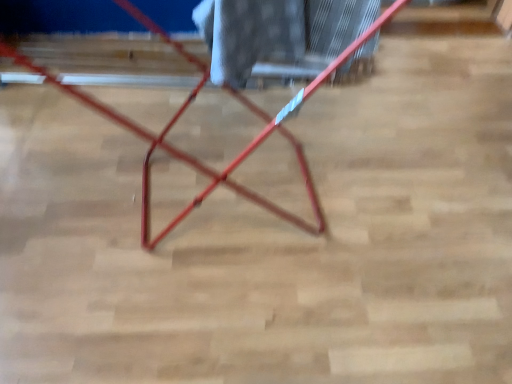
Locate an element on the screen. white textured fabric at center is located at coordinates (278, 35).

The image size is (512, 384). What do you see at coordinates (278, 35) in the screenshot? I see `white textured fabric at center` at bounding box center [278, 35].

Measure the distance between point (318, 26) and camera.

Point (318, 26) is 1.18 meters from camera.

Image resolution: width=512 pixels, height=384 pixels. What do you see at coordinates (183, 151) in the screenshot?
I see `metallic red ladder at center` at bounding box center [183, 151].

Image resolution: width=512 pixels, height=384 pixels. I want to click on metallic red ladder at center, so click(x=183, y=151).

Measure the distance between point (147, 184) and camera.

Point (147, 184) is 1.51 meters from camera.

What is the approximate height of metallic red ladder at center?

metallic red ladder at center is 33.49 inches in height.

In order to click on white textured fabric at center in this screenshot , I will do `click(278, 35)`.

Based on their positions, is white textured fabric at center located to the left or right of metallic red ladder at center?

white textured fabric at center is positioned on metallic red ladder at center's right side.

Is white textured fabric at center in front of or behind metallic red ladder at center in the image?

white textured fabric at center is positioned farther from the viewer than metallic red ladder at center.

Which is more distant, (272,4) or (149,19)?

The point (149,19) is behind.

From the image's perspective, is white textured fabric at center above metallic red ladder at center?

Yes.

From a real-world perspective, who is located higher, white textured fabric at center or metallic red ladder at center?

white textured fabric at center.

Which object is thinner, white textured fabric at center or metallic red ladder at center?

With smaller width is white textured fabric at center.

From their relative heights in the image, would you say white textured fabric at center is taller or shorter than metallic red ladder at center?

white textured fabric at center is shorter than metallic red ladder at center.

Considering the sizes of objects white textured fabric at center and metallic red ladder at center in the image provided, who is bigger, white textured fabric at center or metallic red ladder at center?

metallic red ladder at center is bigger.

Would you say white textured fabric at center is outside metallic red ladder at center?

That's incorrect, white textured fabric at center is not completely outside metallic red ladder at center.

Is white textured fabric at center not close to metallic red ladder at center?

No, white textured fabric at center is in close proximity to metallic red ladder at center.

Is white textured fabric at center turned away from metallic red ladder at center?

Yes, white textured fabric at center is positioned with its back facing metallic red ladder at center.

How different are the orientations of white textured fabric at center and metallic red ladder at center in degrees?

The facing directions of white textured fabric at center and metallic red ladder at center are 0.00119 degrees apart.

Measure the distance from white textured fabric at center to metallic red ladder at center.

white textured fabric at center is 11.15 inches from metallic red ladder at center.

Locate an element on the screen. The height and width of the screenshot is (384, 512). laundry above the metallic red ladder at center (from a real-world perspective) is located at coordinates 278,35.

Is metallic red ladder at center to the left of white textured fabric at center from the viewer's perspective?

Correct, you'll find metallic red ladder at center to the left of white textured fabric at center.

Is the depth of metallic red ladder at center less than that of white textured fabric at center?

Yes.

Is point (165, 146) closer to camera compared to point (366, 5)?

No, (165, 146) is behind (366, 5).

Consider the image. From the image's perspective, is metallic red ladder at center located above or below white textured fabric at center?

From the image's perspective, metallic red ladder at center appears below white textured fabric at center.

From a real-world perspective, between metallic red ladder at center and white textured fabric at center, who is vertically lower?

metallic red ladder at center.

Between metallic red ladder at center and white textured fabric at center, which one has smaller width?

Thinner between the two is white textured fabric at center.

Considering the relative sizes of metallic red ladder at center and white textured fabric at center in the image provided, is metallic red ladder at center shorter than white textured fabric at center?

No.

Between metallic red ladder at center and white textured fabric at center, which one has larger size?

Bigger between the two is metallic red ladder at center.

Is white textured fabric at center surrounded by metallic red ladder at center?

Yes, white textured fabric at center is a part of metallic red ladder at center.

Are metallic red ladder at center and white textured fabric at center beside each other?

No.

Is metallic red ladder at center facing towards white textured fabric at center?

Yes.

What's the angular difference between metallic red ladder at center and white textured fabric at center's facing directions?

0.00119 degrees separate the facing orientations of metallic red ladder at center and white textured fabric at center.

How distant is metallic red ladder at center from white textured fabric at center?

metallic red ladder at center is 11.15 inches away from white textured fabric at center.

Image resolution: width=512 pixels, height=384 pixels. In order to click on furniture in front of the white textured fabric at center in this screenshot , I will do click(183, 151).

This screenshot has height=384, width=512. What are the coordinates of `furniture that is on the left side of white textured fabric at center` in the screenshot? It's located at (183, 151).

This screenshot has height=384, width=512. In order to click on furniture below the white textured fabric at center (from the image's perspective) in this screenshot , I will do coord(183,151).